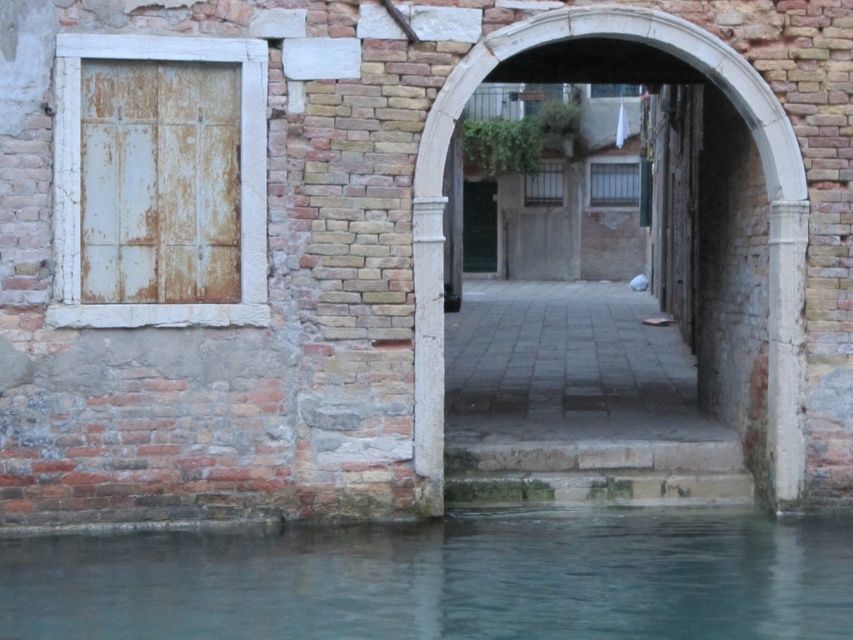
Is clear water at lower center bigger than white stone archway at center?

No.

Which is below, clear water at lower center or white stone archway at center?

clear water at lower center is below.

Measure the distance between point (x=514, y=573) and camera.

Point (x=514, y=573) and camera are 9.15 meters apart.

Identify the location of clear water at lower center. (444, 579).

Is clear water at lower center smaller than rusty white door at left?

No, clear water at lower center is not smaller than rusty white door at left.

Describe the element at coordinates (444, 579) in the screenshot. I see `clear water at lower center` at that location.

The width and height of the screenshot is (853, 640). Find the location of `clear water at lower center`. clear water at lower center is located at coordinates (444, 579).

Based on the photo, can you confirm if white stone archway at center is smaller than rusty white door at left?

Incorrect, white stone archway at center is not smaller in size than rusty white door at left.

At what (x,y) coordinates should I click in order to perform the action: click on white stone archway at center. Please return your answer as a coordinate pair (x, y). This screenshot has width=853, height=640. Looking at the image, I should click on (764, 188).